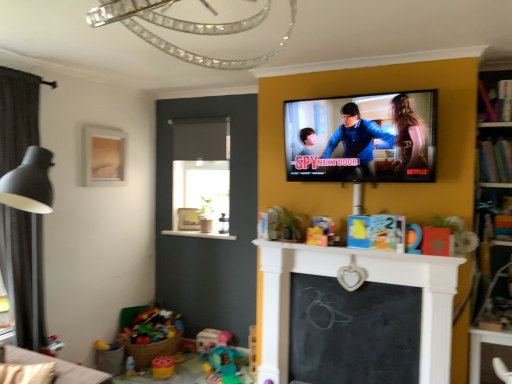
Measure the distance between black chalkboard at center and camera.

The distance of black chalkboard at center from camera is 2.74 meters.

Describe the element at coordinates (495, 96) in the screenshot. I see `wooden bookshelf at upper right, the 2th shelf ordered from the bottom` at that location.

Describe the element at coordinates (412, 238) in the screenshot. The height and width of the screenshot is (384, 512). I see `matte orange toy at center, the 4th toy from the bottom` at that location.

What do you see at coordinates (131, 368) in the screenshot?
I see `translucent plastic cup at lower left, acting as the fourth toy starting from the top` at bounding box center [131, 368].

What do you see at coordinates (223, 366) in the screenshot? This screenshot has height=384, width=512. I see `plastic teal toy at lower center, the 2th toy positioned from the right` at bounding box center [223, 366].

Find the location of a particular element. black chalkboard at center is located at coordinates tap(353, 332).

Is wooden bookshelf at upper right, arranged as the 2th shelf when viewed from the top, bigger or smaller than matte black tv at upper right?

Considering their sizes, wooden bookshelf at upper right, arranged as the 2th shelf when viewed from the top, takes up less space than matte black tv at upper right.

In terms of width, does wooden bookshelf at upper right, the first shelf in the bottom-to-top sequence, look wider or thinner when compared to matte black tv at upper right?

In the image, wooden bookshelf at upper right, the first shelf in the bottom-to-top sequence, appears to be wider than matte black tv at upper right.

From the picture: Does wooden bookshelf at upper right, arranged as the 2th shelf when viewed from the top, touch matte black tv at upper right?

No, wooden bookshelf at upper right, arranged as the 2th shelf when viewed from the top, is not touching matte black tv at upper right.

Which is more to the left, wooden bookshelf at upper right, the first shelf in the bottom-to-top sequence, or matte black tv at upper right?

Positioned to the left is matte black tv at upper right.

From the image's perspective, is wooden frame at upper left, acting as the 1th picture frame starting from the left, located above or below wooden bookshelf at upper right, which is the first shelf from top to bottom?

wooden frame at upper left, acting as the 1th picture frame starting from the left, is below wooden bookshelf at upper right, which is the first shelf from top to bottom.

In the scene shown: Between wooden frame at upper left, arranged as the 1th picture frame when viewed from the top, and wooden bookshelf at upper right, which is the first shelf from top to bottom, which one has less height?

wooden bookshelf at upper right, which is the first shelf from top to bottom, is shorter.

Can you confirm if wooden frame at upper left, acting as the second picture frame starting from the bottom, is smaller than wooden bookshelf at upper right, the 2th shelf ordered from the bottom?

No.

Which is behind, translucent plastic cup at lower left, which is the first toy from bottom to top, or dark grey fabric curtain at left?

Positioned behind is translucent plastic cup at lower left, which is the first toy from bottom to top.

Between translucent plastic cup at lower left, acting as the fourth toy starting from the top, and dark grey fabric curtain at left, which one appears on the left side from the viewer's perspective?

dark grey fabric curtain at left.

From a real-world perspective, is translucent plastic cup at lower left, which is the first toy from bottom to top, below dark grey fabric curtain at left?

Yes, from a real-world perspective, translucent plastic cup at lower left, which is the first toy from bottom to top, is below dark grey fabric curtain at left.

Identify the location of the 1st picture frame behind the matte orange toy at center, acting as the 1th toy starting from the top. This screenshot has height=384, width=512. (103, 157).

From a real-world perspective, who is located lower, wooden frame at upper left, acting as the second picture frame starting from the bottom, or matte orange toy at center, which ranks as the first toy in right-to-left order?

matte orange toy at center, which ranks as the first toy in right-to-left order, is physically lower.

Is point (112, 177) positioned after point (415, 249)?

Yes, it is behind point (415, 249).

Measure the distance from black chalkboard at center to dark grey fabric curtain at left.

black chalkboard at center is 2.04 meters away from dark grey fabric curtain at left.

Based on the photo, from the image's perspective, which is above, black chalkboard at center or dark grey fabric curtain at left?

dark grey fabric curtain at left appears higher in the image.

Based on the photo, which is correct: black chalkboard at center is inside dark grey fabric curtain at left, or outside of it?

black chalkboard at center is spatially situated outside dark grey fabric curtain at left.

Considering the positions of objects black chalkboard at center and dark grey fabric curtain at left in the image provided, who is more to the left, black chalkboard at center or dark grey fabric curtain at left?

dark grey fabric curtain at left.

Does point (407, 230) appear closer or farther from the camera than point (307, 124)?

Point (407, 230).

From the image's perspective, is matte orange toy at center, acting as the 1th toy starting from the top, on top of matte black tv at upper right?

Incorrect, from the image's perspective, matte orange toy at center, acting as the 1th toy starting from the top, is lower than matte black tv at upper right.

Based on their positions, is matte orange toy at center, marked as the 4th toy in a back-to-front arrangement, located to the left or right of matte black tv at upper right?

matte orange toy at center, marked as the 4th toy in a back-to-front arrangement, is positioned on matte black tv at upper right's right side.

The width and height of the screenshot is (512, 384). Find the location of `the 1st toy located beneath the matte black tv at upper right (from a real-world perspective)`. the 1st toy located beneath the matte black tv at upper right (from a real-world perspective) is located at coordinates (412, 238).

Could you tell me if black chalkboard at center is facing wooden frame at upper left, the 2th picture frame from the right?

No, black chalkboard at center does not turn towards wooden frame at upper left, the 2th picture frame from the right.

Where is `the 2nd picture frame to the left of the black chalkboard at center, starting your count from the anchor`? The height and width of the screenshot is (384, 512). the 2nd picture frame to the left of the black chalkboard at center, starting your count from the anchor is located at coordinates (103, 157).

From the image's perspective, is black chalkboard at center above or below wooden frame at upper left, the first picture frame viewed from the front?

Based on their image positions, black chalkboard at center is located beneath wooden frame at upper left, the first picture frame viewed from the front.

The width and height of the screenshot is (512, 384). Find the location of `television that is above the wooden bookshelf at upper right, arranged as the 2th shelf when viewed from the top (from the image's perspective)`. television that is above the wooden bookshelf at upper right, arranged as the 2th shelf when viewed from the top (from the image's perspective) is located at coordinates (362, 138).

There is a wooden bookshelf at upper right, which is the first shelf from top to bottom. Where is `the 1st picture frame below it (from the image's perspective)`? This screenshot has width=512, height=384. the 1st picture frame below it (from the image's perspective) is located at coordinates (103, 157).

Which object lies further to the anchor point translucent plastic cup at lower left, which is counted as the third toy, starting from the back, black chalkboard at center or wooden bookshelf at upper right, the 2th shelf ordered from the bottom?

wooden bookshelf at upper right, the 2th shelf ordered from the bottom, is further to translucent plastic cup at lower left, which is counted as the third toy, starting from the back.

Considering their positions, is wooden frame at upper left, acting as the second picture frame starting from the bottom, positioned further to bright multicolored plastic toys at lower left, the 2th toy positioned from the top, than matte black tv at upper right?

Among the two, matte black tv at upper right is located further to bright multicolored plastic toys at lower left, the 2th toy positioned from the top.

Which object lies further to the anchor point wooden bookshelf at upper right, the 2th shelf ordered from the bottom, plastic teal toy at lower center, the 3th toy in the front-to-back sequence, or plastic toy at lower left?

plastic toy at lower left is further to wooden bookshelf at upper right, the 2th shelf ordered from the bottom.

When comparing their distances from plastic toy at lower left, does bright multicolored plastic toys at lower left, which is the 1th toy from back to front, or dark grey fabric curtain at left seem closer?

bright multicolored plastic toys at lower left, which is the 1th toy from back to front, is positioned closer to the anchor plastic toy at lower left.

Which object lies nearer to the anchor point plastic teal toy at lower center, which ranks as the 2th toy in back-to-front order, black chalkboard at center or translucent plastic cup at lower left, acting as the fourth toy starting from the top?

The object closer to plastic teal toy at lower center, which ranks as the 2th toy in back-to-front order, is translucent plastic cup at lower left, acting as the fourth toy starting from the top.

Based on their spatial positions, is wooden bookshelf at upper right, which is the first shelf from top to bottom, or dark grey fabric curtain at left further from black chalkboard at center?

dark grey fabric curtain at left is positioned further to the anchor black chalkboard at center.

Based on their spatial positions, is matte gold picture frame at center, which ranks as the second picture frame in left-to-right order, or plastic toy at lower left closer to matte orange toy at center, which ranks as the first toy in right-to-left order?

plastic toy at lower left lies closer to matte orange toy at center, which ranks as the first toy in right-to-left order, than the other object.

Estimate the real-world distances between objects in this image. Which object is closer to wooden bookshelf at upper right, the 2th shelf ordered from the bottom, matte black tv at upper right or wooden bookshelf at upper right, arranged as the 2th shelf when viewed from the top?

wooden bookshelf at upper right, arranged as the 2th shelf when viewed from the top, is closer to wooden bookshelf at upper right, the 2th shelf ordered from the bottom.

This screenshot has width=512, height=384. Find the location of `picture frame located between translucent plastic cup at lower left, which is the first toy from bottom to top, and black chalkboard at center in the left-right direction`. picture frame located between translucent plastic cup at lower left, which is the first toy from bottom to top, and black chalkboard at center in the left-right direction is located at coordinates (188, 219).

Where is `television between matte gold picture frame at center, placed as the 2th picture frame when sorted from top to bottom, and wooden bookshelf at upper right, which is the first shelf from top to bottom, from left to right`? This screenshot has height=384, width=512. television between matte gold picture frame at center, placed as the 2th picture frame when sorted from top to bottom, and wooden bookshelf at upper right, which is the first shelf from top to bottom, from left to right is located at coordinates click(362, 138).

Identify the location of shelf situated between translucent plastic cup at lower left, acting as the fourth toy starting from the top, and wooden bookshelf at upper right, which is the first shelf from top to bottom, from left to right. The height and width of the screenshot is (384, 512). (495, 160).

Locate an element on the screen. curtain between wooden frame at upper left, acting as the second picture frame starting from the bottom, and plastic toy at lower left from top to bottom is located at coordinates click(24, 274).